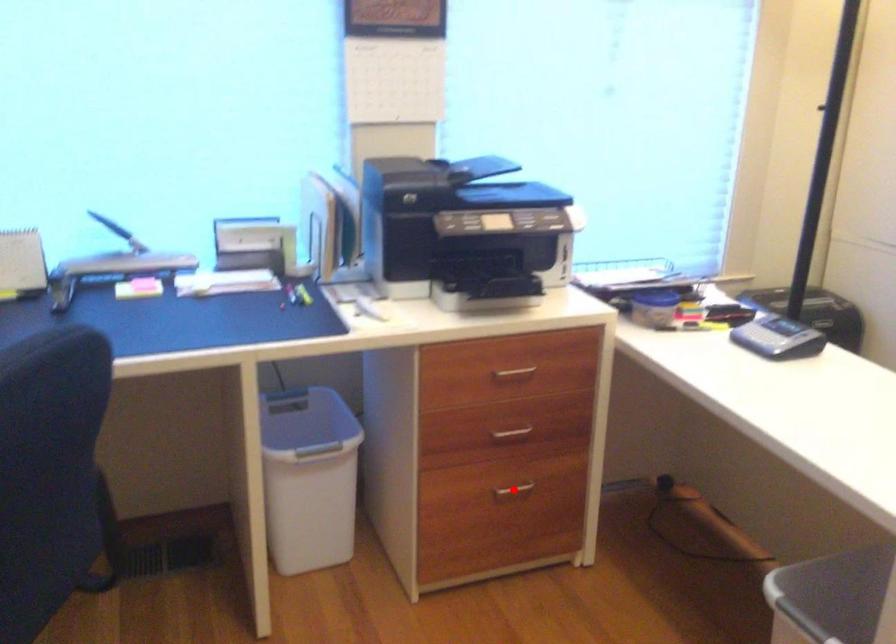
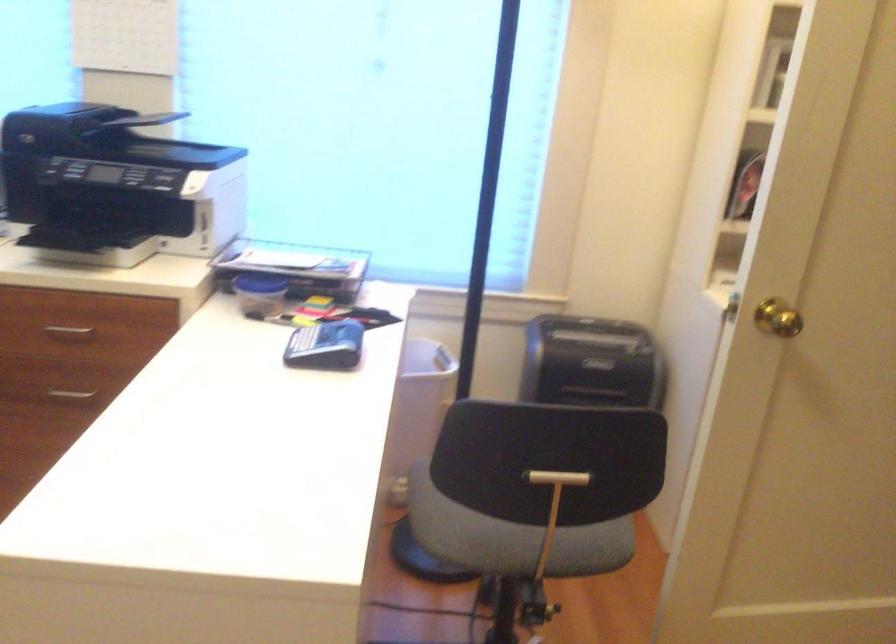
Question: I am providing you with two images of the same scene from different viewpoints. A red point is marked on the first image. At the location where the point appears in image 1, is it still visible in image 2?

Choices:
 (A) Yes
 (B) No

Answer: (B)